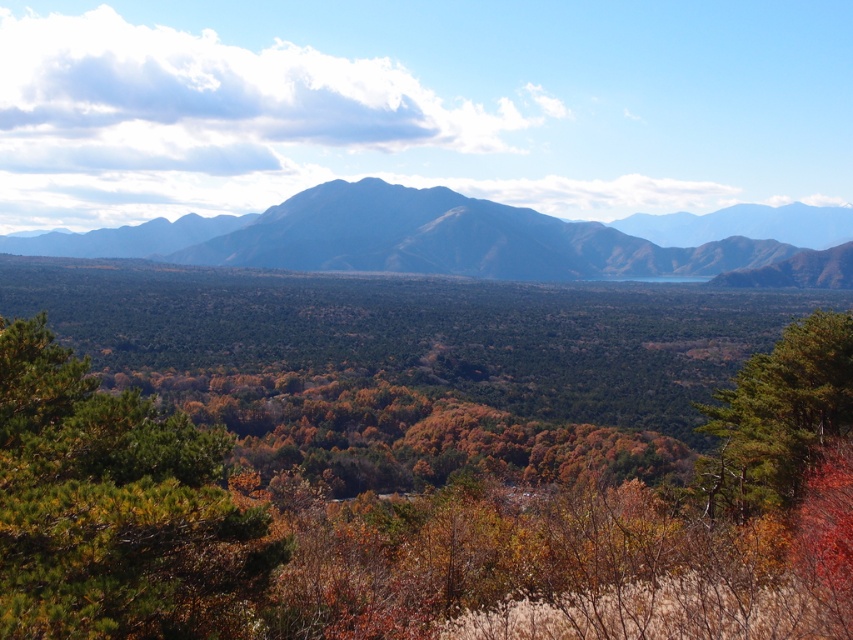
Question: Is blue-gray rock formation at center above green matte tree at center?

Choices:
 (A) yes
 (B) no

Answer: (A)

Question: Which of the following is the farthest from the observer?

Choices:
 (A) green matte forest at center
 (B) green matte tree at center

Answer: (B)

Question: Among these points, which one is nearest to the camera?

Choices:
 (A) pos(103,474)
 (B) pos(462,196)
 (C) pos(154,435)
 (D) pos(737,513)

Answer: (A)

Question: Among these objects, which one is nearest to the camera?

Choices:
 (A) green matte forest at center
 (B) blue-gray rock formation at center
 (C) green needle-like tree at center-left

Answer: (C)

Question: Can you confirm if green needle-like tree at center-left is bigger than green matte tree at center?

Choices:
 (A) no
 (B) yes

Answer: (A)

Question: Is green needle-like tree at center-left to the left of green matte tree at center from the viewer's perspective?

Choices:
 (A) yes
 (B) no

Answer: (A)